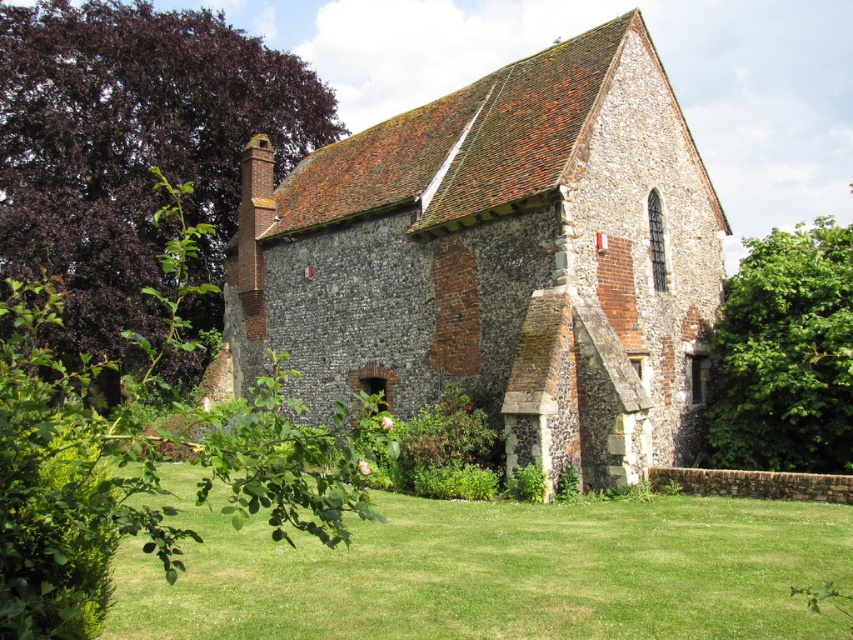
Who is higher up, brown stone church at center or green grass at lower center?

Positioned higher is brown stone church at center.

Does brown stone church at center have a larger size compared to green grass at lower center?

Yes.

Measure the distance between brown stone church at center and camera.

131.99 feet

The image size is (853, 640). Identify the location of brown stone church at center. (x=498, y=259).

Between brown stone church at center and green leafy tree at right, which one is positioned higher?

green leafy tree at right

Between point (300, 317) and point (828, 358), which one is positioned behind?

Positioned behind is point (300, 317).

Which is in front, point (630, 340) or point (730, 428)?

Point (630, 340) is more forward.

I want to click on brown stone church at center, so click(x=498, y=259).

Who is more forward, (611, 518) or (831, 355)?

Point (611, 518)

In order to click on green grass at lower center in this screenshot , I will do `click(496, 570)`.

Find the location of `green grass at lower center`. green grass at lower center is located at coordinates (496, 570).